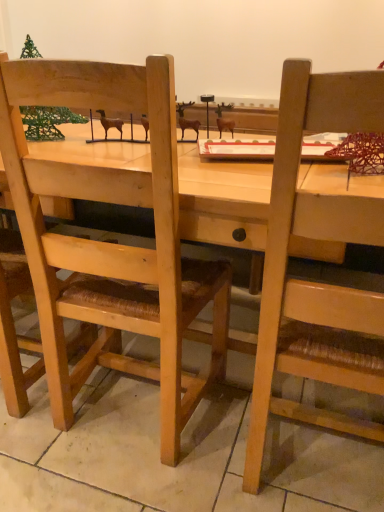
Question: From the image's perspective, is wooden chair at left, the first chair when ordered from left to right, positioned above or below wooden chair at right, which appears as the 2th chair when viewed from the left?

Choices:
 (A) below
 (B) above

Answer: (B)

Question: In the image, is wooden chair at left, the first chair when ordered from left to right, on the left side or the right side of wooden chair at right, arranged as the 1th chair when viewed from the right?

Choices:
 (A) right
 (B) left

Answer: (B)

Question: Which is farther from the green wire christmas tree at upper left?

Choices:
 (A) wooden chair at right, which appears as the 2th chair when viewed from the left
 (B) wooden chair at left, the first chair when ordered from left to right

Answer: (A)

Question: Based on their relative distances, which object is farther from the wooden chair at left, the first chair when ordered from left to right?

Choices:
 (A) wooden chair at right, which appears as the 2th chair when viewed from the left
 (B) green wire christmas tree at upper left

Answer: (A)